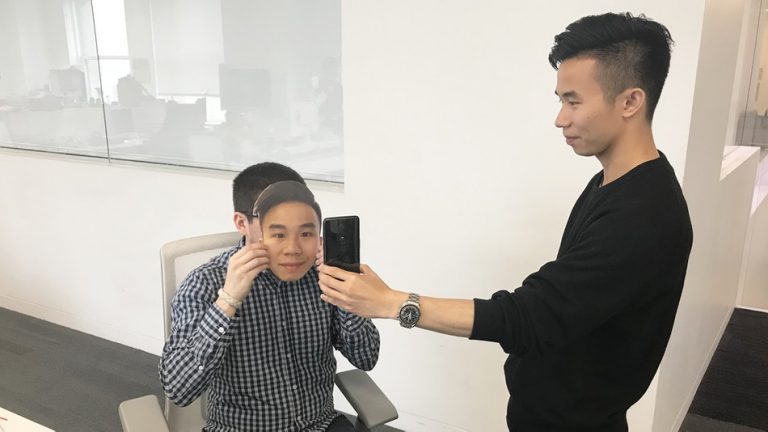
The width and height of the screenshot is (768, 432). What are the coordinates of `wall` in the screenshot? It's located at (490, 173).